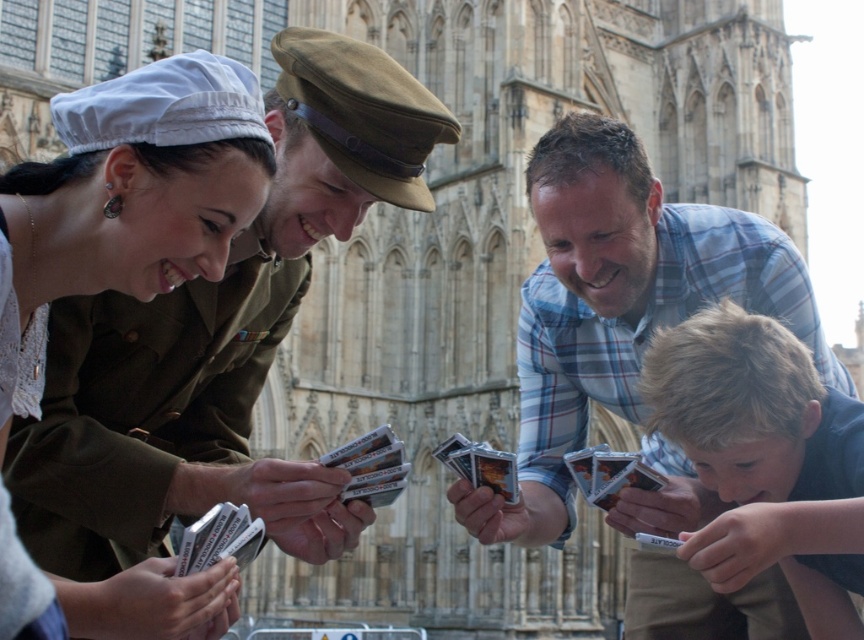
Question: Can you confirm if blue plaid shirt at center is positioned to the right of matte khaki uniform at center?

Choices:
 (A) yes
 (B) no

Answer: (A)

Question: Among these points, which one is farthest from the camera?

Choices:
 (A) (699, 332)
 (B) (468, 492)

Answer: (B)

Question: Is the position of blue plaid shirt at center more distant than that of blonde hair boy at lower right?

Choices:
 (A) yes
 (B) no

Answer: (A)

Question: Which point is closer to the camera?

Choices:
 (A) (759, 616)
 (B) (766, 541)

Answer: (B)

Question: Which of the following is the closest to the observer?

Choices:
 (A) (797, 570)
 (B) (567, 305)

Answer: (A)

Question: Does blue plaid shirt at center have a smaller size compared to blonde hair boy at lower right?

Choices:
 (A) yes
 (B) no

Answer: (B)